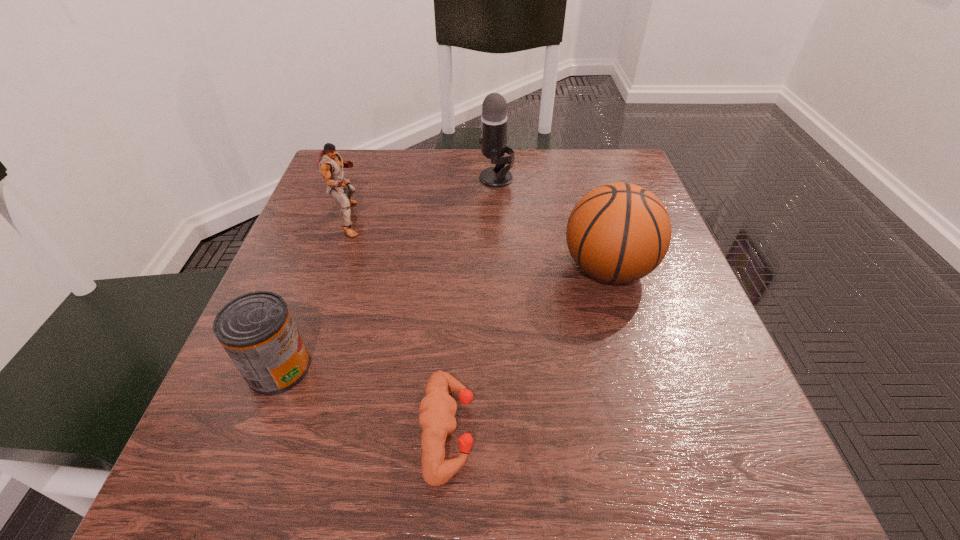
The image size is (960, 540). Find the location of `the farthest object`. the farthest object is located at coordinates (494, 118).

What are the coordinates of `microphone` in the screenshot? It's located at (494, 118).

Locate an element on the screen. This screenshot has width=960, height=540. the taller puncher is located at coordinates (331, 165).

Image resolution: width=960 pixels, height=540 pixels. Identify the location of the farther puncher. (331, 165).

The image size is (960, 540). In order to click on basketball in this screenshot , I will do `click(619, 232)`.

Identify the location of can. (257, 330).

At what (x,y) coordinates should I click in order to perform the action: click on the nearer puncher. Please return your answer as a coordinate pair (x, y). Looking at the image, I should click on (438, 409).

You are a GUI agent. You are given a task and a screenshot of the screen. Output one action in this format:
    pyautogui.click(x=<x>, y=<y>)
    Task: Click on the shortest object
    The height and width of the screenshot is (540, 960).
    Given the screenshot: What is the action you would take?
    pyautogui.click(x=438, y=409)

Where is `free location located 0.080m on the back of the microphone`? The height and width of the screenshot is (540, 960). free location located 0.080m on the back of the microphone is located at coordinates (494, 152).

I want to click on free region located on the front-facing side of the left puncher, so click(496, 219).